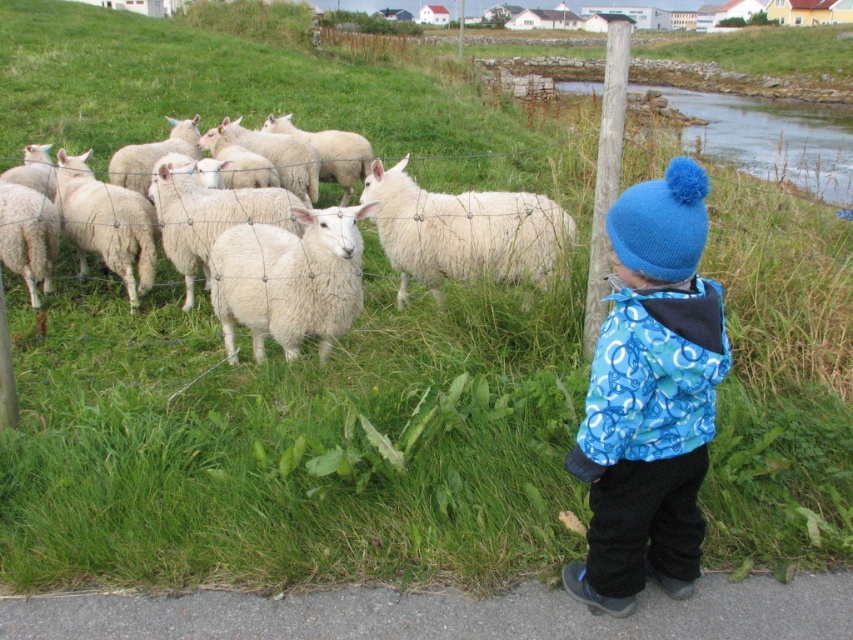
Question: Among these objects, which one is farthest from the camera?

Choices:
 (A) white woolen sheep at center
 (B) white woolly sheep at center
 (C) blue knitted hat at upper right
 (D) white woolly sheep at left

Answer: (B)

Question: Does white woolen sheep at center have a greater width compared to white woolly sheep at center?

Choices:
 (A) no
 (B) yes

Answer: (A)

Question: Can you confirm if white woolen sheep at center is positioned above white woolly sheep at center?

Choices:
 (A) yes
 (B) no

Answer: (B)

Question: Which object is closer to the camera taking this photo?

Choices:
 (A) white woolen sheep at center
 (B) white woolly sheep at left

Answer: (A)

Question: Which of these objects is positioned farthest from the white woolly sheep at center?

Choices:
 (A) white woolen sheep at center
 (B) white woolly sheep at left
 (C) blue knitted hat at upper right

Answer: (C)

Question: Is white woolen sheep at center bigger than white woolly sheep at center?

Choices:
 (A) no
 (B) yes

Answer: (A)